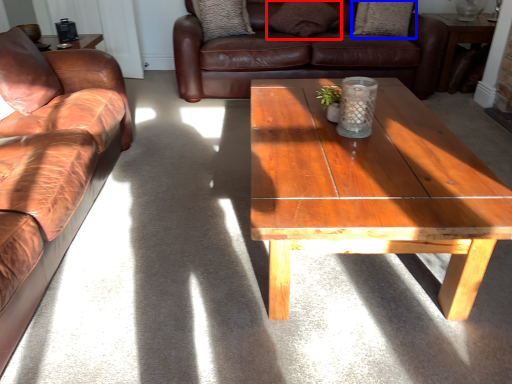
Question: Which point is closer to the camera, pillow (highlighted by a red box) or pillow (highlighted by a blue box)?

Choices:
 (A) pillow
 (B) pillow

Answer: (A)